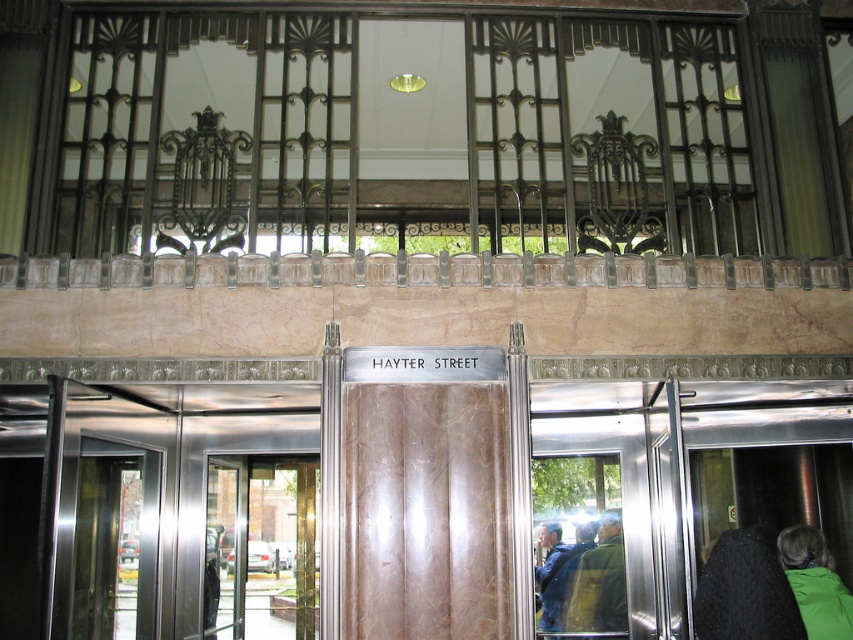
You are standing at the entrance of the building and want to take a photo of the point at coordinates point (792, 563). Can you estimate how far you need to move forward or backward to focus on that point?

The point at point (792, 563) is 14.53 feet away from the camera. To focus on that point, you should move so that you are approximately 14.53 feet away from the point.

You are standing at the entrance of the building and see both the black knitted sweater at lower right and the blue denim jacket at lower right. Which one is shorter in height?

The black knitted sweater at lower right is shorter than the blue denim jacket at lower right.